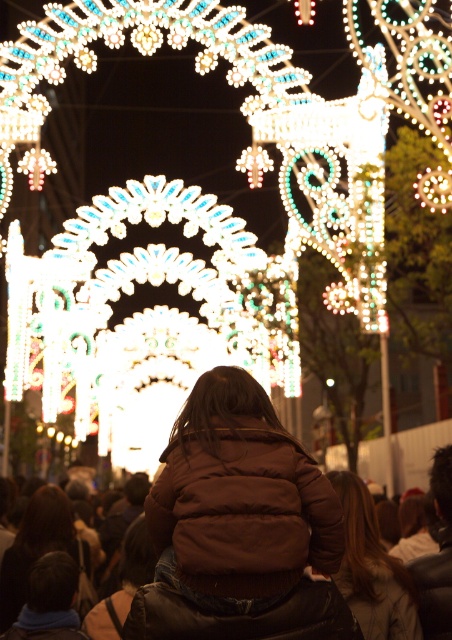
Which is more to the left, brown puffy jacket at center or brown leather jacket at lower center?

brown puffy jacket at center is more to the left.

Does point (285, 556) come in front of point (433, 570)?

Yes, it is in front of point (433, 570).

At what (x,y) coordinates should I click in order to perform the action: click on brown puffy jacket at center. Please return your answer as a coordinate pair (x, y). Looking at the image, I should click on (244, 509).

From the picture: Can you confirm if brown leather jacket at lower center is thinner than brown leather jacket at center?

No, brown leather jacket at lower center is not thinner than brown leather jacket at center.

Can you confirm if brown leather jacket at lower center is bigger than brown leather jacket at center?

Indeed, brown leather jacket at lower center has a larger size compared to brown leather jacket at center.

This screenshot has width=452, height=640. Describe the element at coordinates (264, 605) in the screenshot. I see `brown leather jacket at lower center` at that location.

Where is `brown leather jacket at lower center`? The height and width of the screenshot is (640, 452). brown leather jacket at lower center is located at coordinates click(264, 605).

Does point (380, 627) come closer to viewer compared to point (8, 568)?

Yes, it is in front of point (8, 568).

The height and width of the screenshot is (640, 452). I want to click on brown leather jacket at center, so click(x=371, y=568).